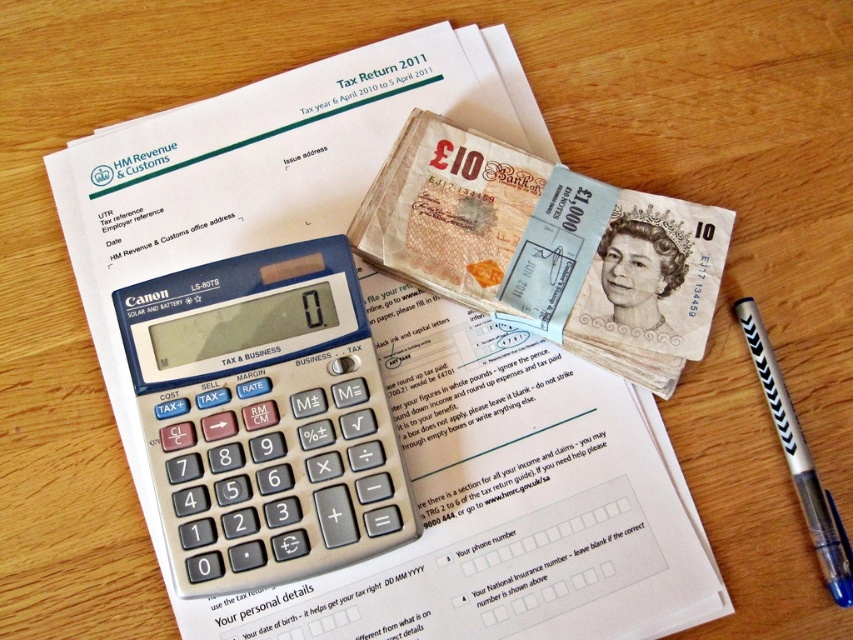
You are preparing your tax return and need to use the silver metallic calculator at center to calculate your expenses. However, you also need to sign the form with the black plastic pen at lower right. Which object should you use first if you want to follow the natural workflow of left to right?

You should use the silver metallic calculator at center first because it is located to the left of the black plastic pen at lower right, following the left to right workflow.

You are a tax preparer who needs to place the silver metallic calculator at center and the black plastic pen at lower right into a drawer that is 16 inches wide. Can both items fit side by side in the drawer without overlapping?

The distance between the silver metallic calculator at center and the black plastic pen at lower right is 15.74 inches. Since the drawer is 16 inches wide, there is enough space for both items to fit side by side without overlapping.

You are preparing your tax return and need to place the silver metallic calculator at center and the light brown paper money at center on the table without them overlapping. What is the minimum distance you should keep between them?

The silver metallic calculator at center is 6.80 inches away from light brown paper money at center, so the minimum distance you should keep between them is 6.80 inches to prevent overlapping.